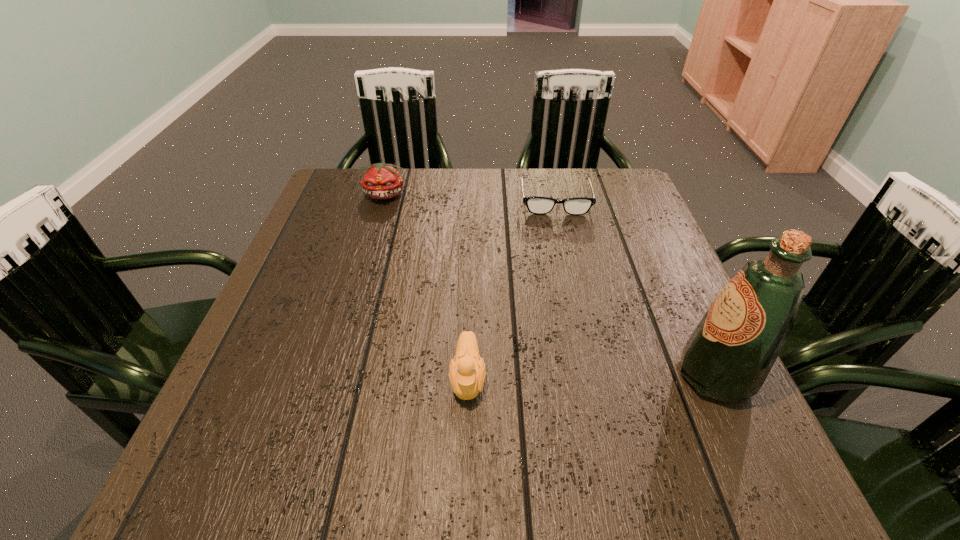
Locate an element on the screen. This screenshot has width=960, height=540. blank region between the duckling and the leftmost object is located at coordinates (426, 287).

Locate an element on the screen. This screenshot has width=960, height=540. free area in between the third object from left to right and the duckling is located at coordinates (512, 289).

At what (x,y) coordinates should I click in order to perform the action: click on empty location between the rightmost object and the tomato. Please return your answer as a coordinate pair (x, y). Looking at the image, I should click on (550, 286).

Identify which object is the third nearest to the duckling. Please provide its 2D coordinates. Your answer should be formatted as a tuple, i.e. [(x, y)], where the tuple contains the x and y coordinates of a point satisfying the conditions above.

[(381, 181)]

The image size is (960, 540). What are the coordinates of `object that is the closest to the second object from left to right` in the screenshot? It's located at (728, 357).

Image resolution: width=960 pixels, height=540 pixels. In order to click on free space that satisfies the following two spatial constraints: 1. on the front side of the leftmost object; 2. on the front-facing side of the olive oil in this screenshot , I will do `click(332, 376)`.

Find the location of a particular element. This screenshot has width=960, height=540. blank space that satisfies the following two spatial constraints: 1. on the front side of the tallest object; 2. on the front-facing side of the spectacles is located at coordinates click(595, 376).

Find the location of `free spot that satisfies the following two spatial constraints: 1. on the front side of the tallest object; 2. on the front-facing side of the spectacles`. free spot that satisfies the following two spatial constraints: 1. on the front side of the tallest object; 2. on the front-facing side of the spectacles is located at coordinates (595, 376).

At what (x,y) coordinates should I click in order to perform the action: click on free point that satisfies the following two spatial constraints: 1. on the front side of the tallest object; 2. on the front-facing side of the spectacles. Please return your answer as a coordinate pair (x, y). Image resolution: width=960 pixels, height=540 pixels. Looking at the image, I should click on (595, 376).